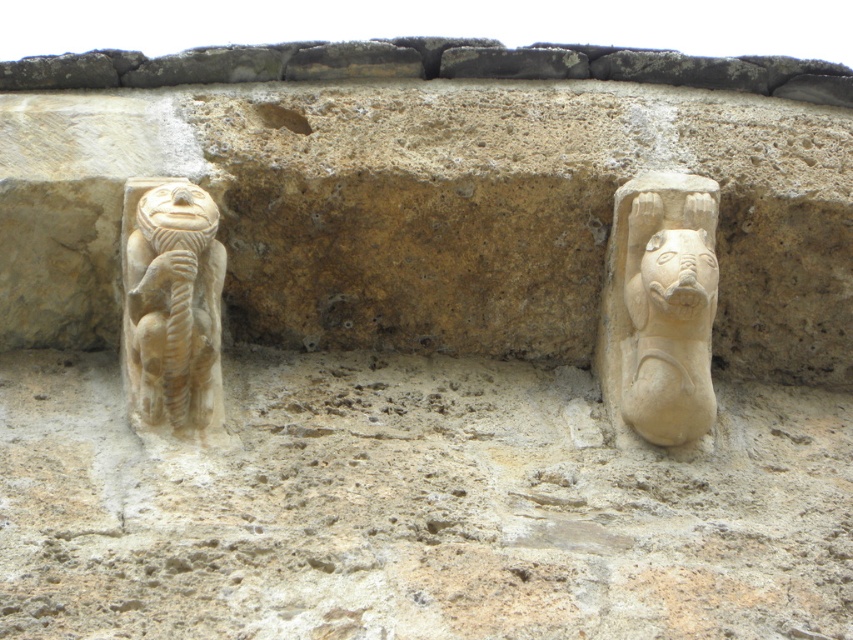
Question: Which of the following is the farthest from the observer?

Choices:
 (A) (666, 266)
 (B) (653, 433)

Answer: (B)

Question: Is beige stone lion at right above beige stone monkey at left?

Choices:
 (A) yes
 (B) no

Answer: (B)

Question: From the image, what is the correct spatial relationship of beige stone monkey at left in relation to white stone face at right?

Choices:
 (A) left
 (B) right

Answer: (A)

Question: Which point appears closest to the camera in this image?

Choices:
 (A) (688, 275)
 (B) (189, 234)

Answer: (A)

Question: Where is beige stone lion at right located in relation to beige stone monkey at left in the image?

Choices:
 (A) below
 (B) above

Answer: (A)

Question: Which is farther from the beige stone lion at right?

Choices:
 (A) beige stone monkey at left
 (B) white stone face at right

Answer: (A)